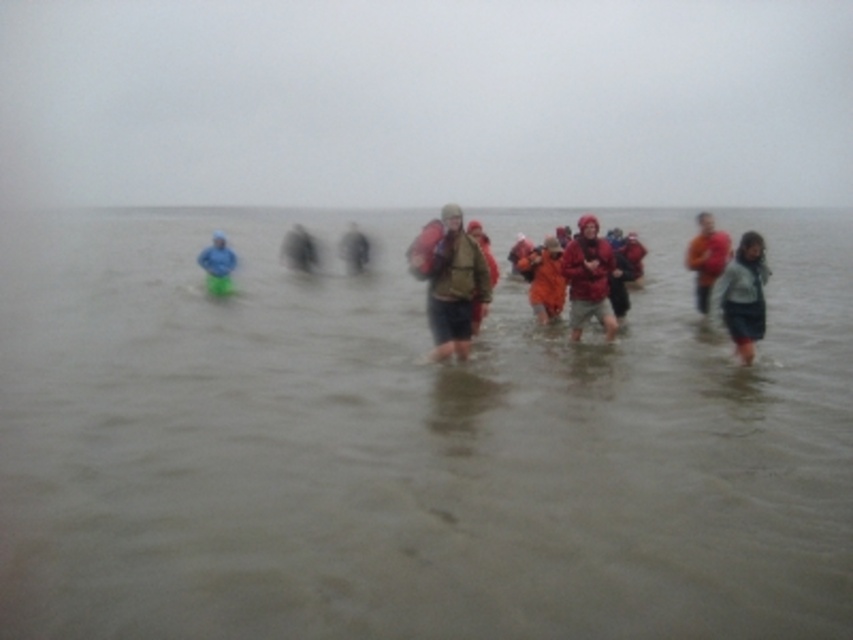
Who is positioned more to the right, brown matte jacket at center or matte brown jacket at center?

matte brown jacket at center is more to the right.

Which of these two, brown matte jacket at center or matte brown jacket at center, stands shorter?

matte brown jacket at center

Is point (450, 259) positioned before point (476, 316)?

Yes.

Identify the location of brown matte jacket at center. (451, 284).

Is brown murky water at center further to the viewer compared to matte brown jacket at center?

No, brown murky water at center is closer to the viewer.

The width and height of the screenshot is (853, 640). Describe the element at coordinates (410, 442) in the screenshot. I see `brown murky water at center` at that location.

I want to click on brown murky water at center, so click(x=410, y=442).

From the picture: Can you confirm if brown murky water at center is smaller than orange fabric jacket at center?

Incorrect, brown murky water at center is not smaller in size than orange fabric jacket at center.

Can you confirm if brown murky water at center is bigger than orange fabric jacket at center?

Yes.

At what (x,y) coordinates should I click in order to perform the action: click on brown murky water at center. Please return your answer as a coordinate pair (x, y). Image resolution: width=853 pixels, height=640 pixels. Looking at the image, I should click on (410, 442).

I want to click on brown murky water at center, so click(x=410, y=442).